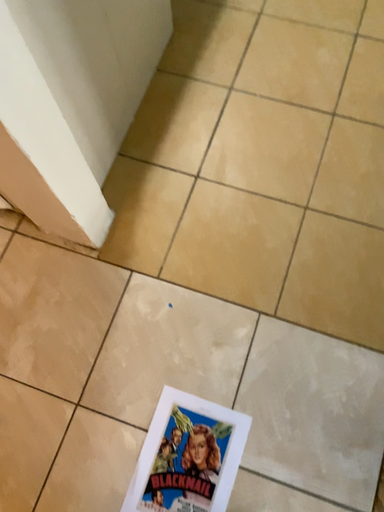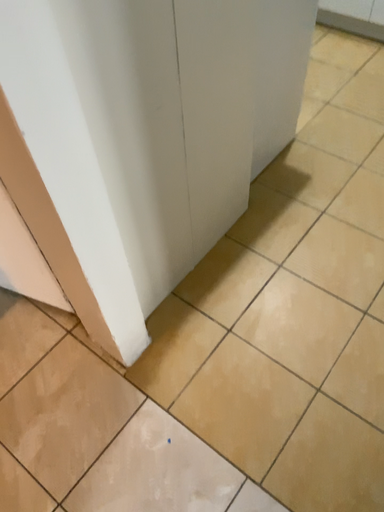
Question: Which way did the camera rotate in the video?

Choices:
 (A) rotated right
 (B) rotated left

Answer: (B)